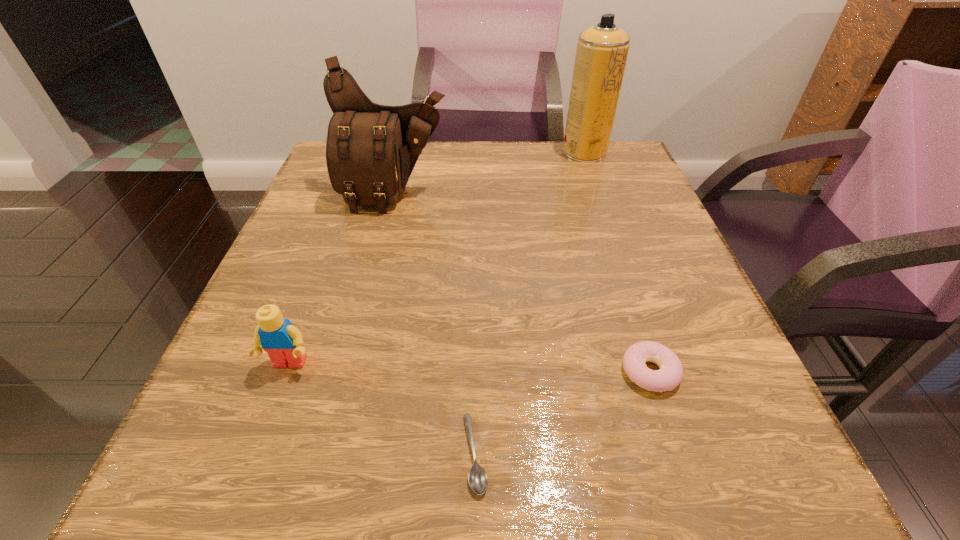
Locate an element on the screen. Image resolution: width=960 pixels, height=540 pixels. vacant region at the far edge of the desktop is located at coordinates (422, 179).

I want to click on vacant area at the near edge, so click(x=463, y=475).

Find the location of a particular element. This screenshot has width=960, height=540. vacant space at the left edge is located at coordinates (270, 416).

The height and width of the screenshot is (540, 960). I want to click on free spot at the right edge of the desktop, so click(x=619, y=287).

In the image, there is a desktop. Where is `blank space at the far right corner`? blank space at the far right corner is located at coordinates (623, 143).

Find the location of a particular element. This screenshot has height=540, width=960. vacant area that lies between the shoulder bag and the third object from left to right is located at coordinates (435, 324).

The height and width of the screenshot is (540, 960). I want to click on free space between the nearest object and the shoulder bag, so click(x=435, y=324).

Where is `vacant area that lies between the doughnut and the third shortest object`? vacant area that lies between the doughnut and the third shortest object is located at coordinates (469, 368).

Where is `free space between the shoulder bag and the farthest object`? The height and width of the screenshot is (540, 960). free space between the shoulder bag and the farthest object is located at coordinates (490, 173).

The image size is (960, 540). Find the location of `empty space between the soupspoon and the doughnut`. empty space between the soupspoon and the doughnut is located at coordinates (x=563, y=413).